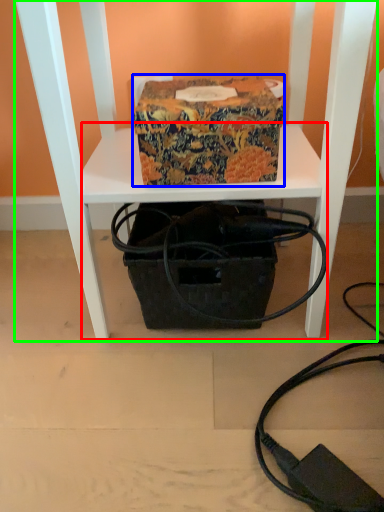
Question: Which is nearer to the table (highlighted by a red box)? cardboard box (highlighted by a blue box) or furniture (highlighted by a green box).

Choices:
 (A) cardboard box
 (B) furniture

Answer: (B)